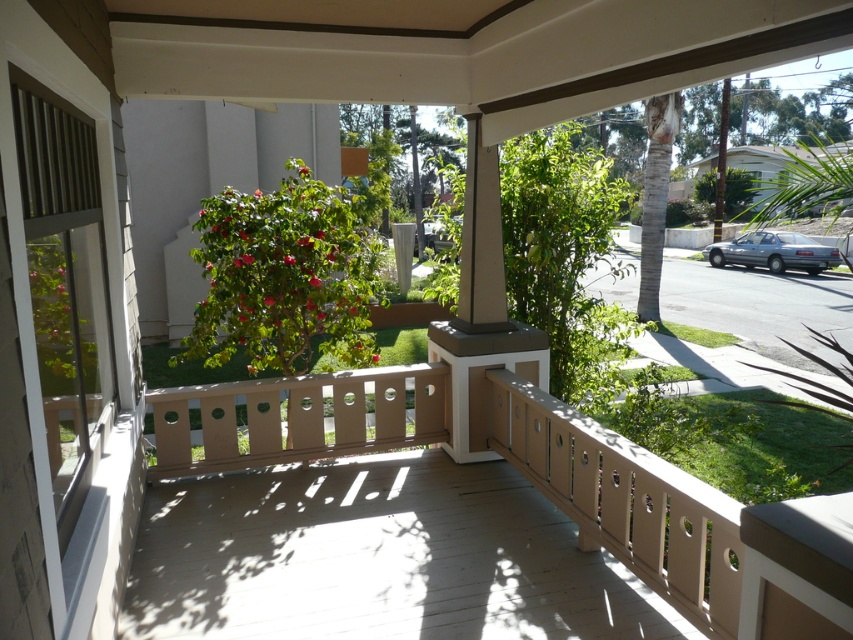
You are standing on the wooden deck of the porch and want to walk towards the silver metallic sedan at right. Which direction should you move to avoid the green leafy bush at center?

To reach the silver metallic sedan at right while avoiding the green leafy bush at center, move to the right side of the porch since the bush is positioned below the sedan, meaning it is in front of the sedan from your perspective on the deck.

You are standing on the wooden deck of the porch and want to reach a decorative item located at point [194,344]. If your current position is 16.23 feet away from that point, can you easily walk to it without needing to move any obstacles?

The point [194,344] is 16.23 feet away from the viewer. Since there are no obstacles mentioned in the scene description, you can easily walk to it.